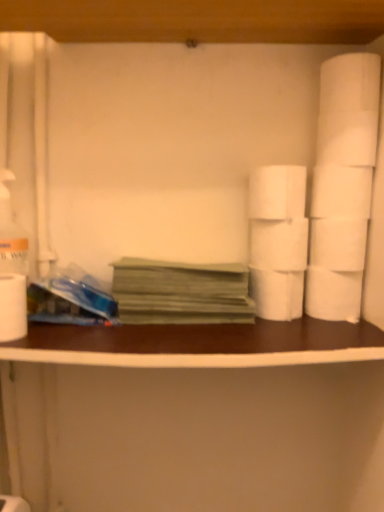
Find the location of a particular element. This screenshot has width=384, height=512. free space in front of green paper at center is located at coordinates (186, 335).